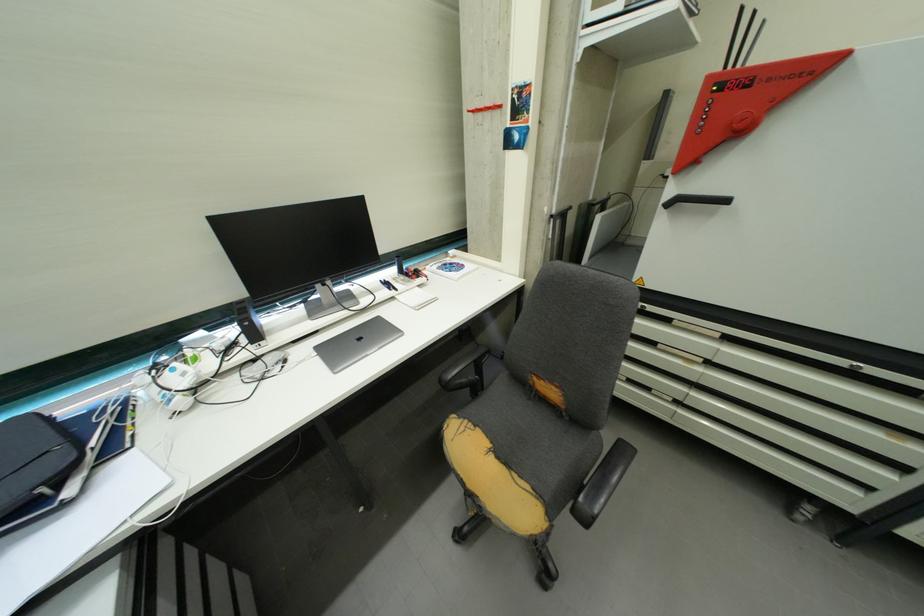
What are the coordinates of `red machine dial` in the screenshot? It's located at (746, 100).